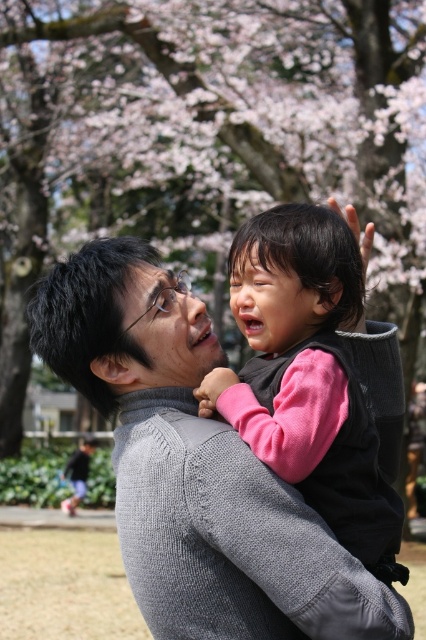
Can you confirm if smooth pink blossoms at upper center is smaller than pink fleece vest at center?

No.

Who is more distant from viewer, (331, 84) or (293, 380)?

Point (331, 84)

Describe the element at coordinates (210, 132) in the screenshot. I see `smooth pink blossoms at upper center` at that location.

Where is `smooth pink blossoms at upper center`? Image resolution: width=426 pixels, height=640 pixels. smooth pink blossoms at upper center is located at coordinates (210, 132).

Between smooth pink blossoms at upper center and gray knitted sweater at center, which one has more height?

smooth pink blossoms at upper center

Does smooth pink blossoms at upper center appear under gray knitted sweater at center?

Incorrect, smooth pink blossoms at upper center is not positioned below gray knitted sweater at center.

Who is more forward, (135, 195) or (261, 621)?

Point (261, 621) is more forward.

At what (x,y) coordinates should I click in order to perform the action: click on smooth pink blossoms at upper center. Please return your answer as a coordinate pair (x, y). The image size is (426, 640). Looking at the image, I should click on (210, 132).

Does gray knitted sweater at center have a lesser width compared to pink fleece vest at center?

In fact, gray knitted sweater at center might be wider than pink fleece vest at center.

Where is `gray knitted sweater at center`? This screenshot has height=640, width=426. gray knitted sweater at center is located at coordinates (195, 468).